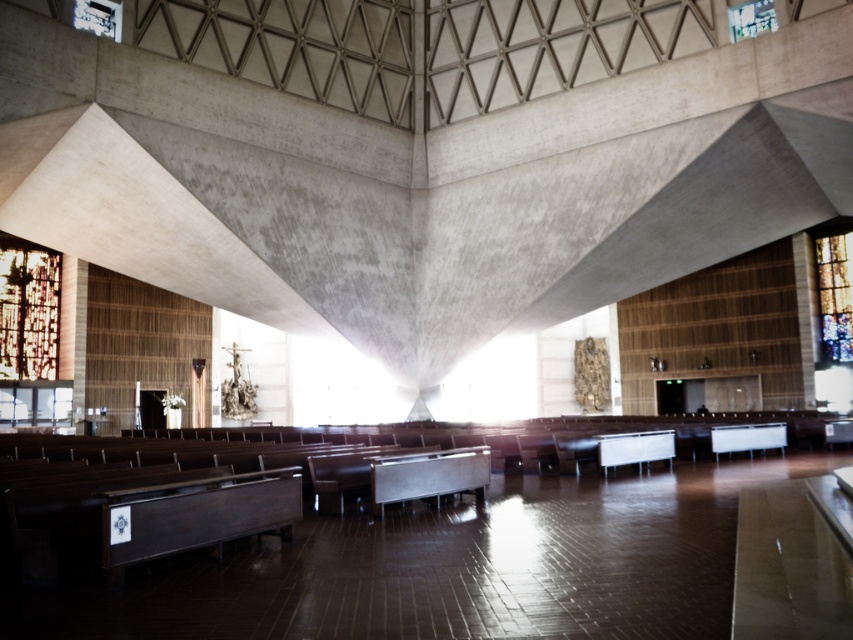
Question: Does stained glass window at left appear on the left side of stained glass window at right?

Choices:
 (A) yes
 (B) no

Answer: (A)

Question: Can you confirm if stained glass window at left is positioned below stained glass window at right?

Choices:
 (A) yes
 (B) no

Answer: (A)

Question: Is stained glass window at left wider than stained glass window at right?

Choices:
 (A) yes
 (B) no

Answer: (B)

Question: Among these points, which one is farthest from the camera?

Choices:
 (A) (821, 264)
 (B) (32, 288)

Answer: (A)